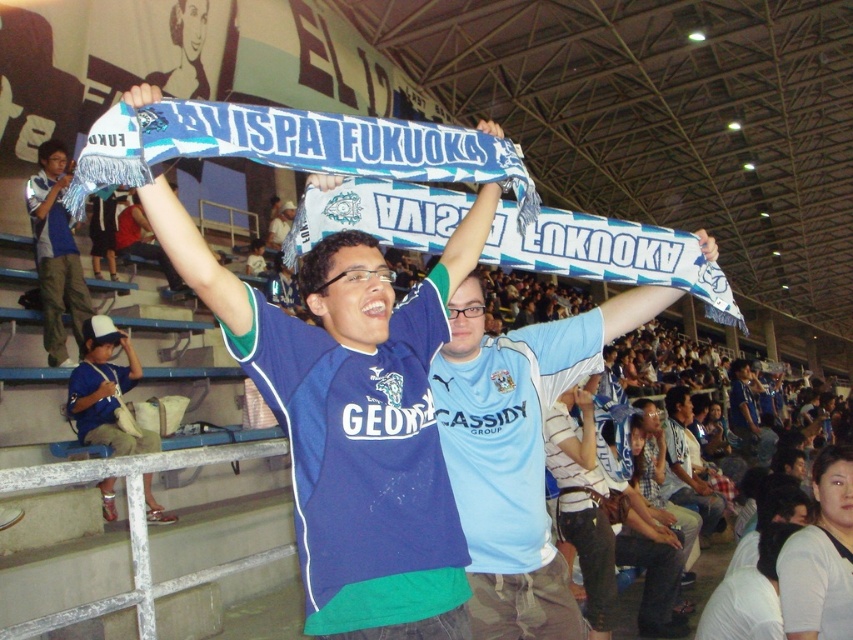
You are a photographer at the stadium and want to capture a photo where both the matte blue scarf at left and the blue jersey at center are clearly visible. Given their sizes, which object should you focus on first to ensure both are in frame?

The matte blue scarf at left is taller than the blue jersey at center, so you should focus on the matte blue scarf at left first to ensure both fit within the frame.

You are a photographer at the stadium and want to capture both the matte blue scarf at center and the matte blue scarf at left in a single shot. Based on their positions, which scarf should you focus on first to ensure both are in frame?

You should focus on the matte blue scarf at center first because it is in front of the matte blue scarf at left, so adjusting the camera to include the closer one ensures the background one is also captured.